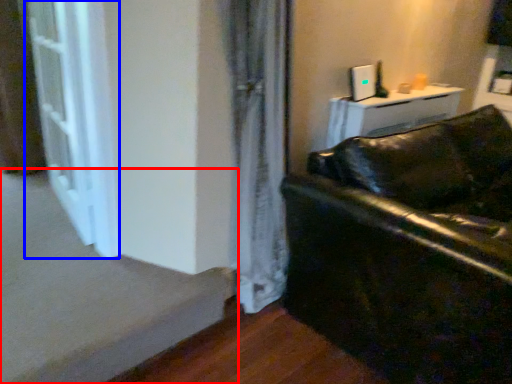
Question: Among these objects, which one is farthest to the camera, stairwell (highlighted by a red box) or screen door (highlighted by a blue box)?

Choices:
 (A) stairwell
 (B) screen door

Answer: (B)